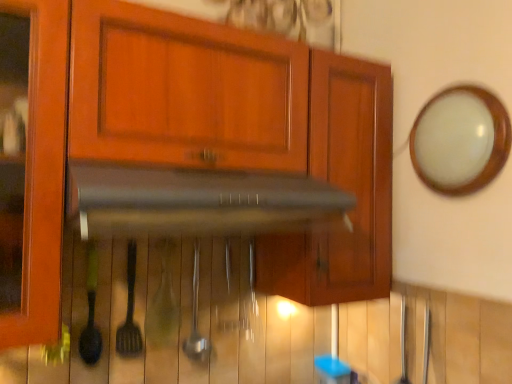
Question: From a real-world perspective, is black matte vent at center physically above metallic spatula at center, positioned as the 1th silverware in left-to-right order?

Choices:
 (A) no
 (B) yes

Answer: (B)

Question: Can you confirm if black matte vent at center is bigger than metallic spatula at center, which is counted as the 2th silverware, starting from the right?

Choices:
 (A) no
 (B) yes

Answer: (B)

Question: Does black matte vent at center lie in front of metallic spatula at center, positioned as the 1th silverware in left-to-right order?

Choices:
 (A) no
 (B) yes

Answer: (B)

Question: Is black matte vent at center aimed at metallic spatula at center, positioned as the 1th silverware in left-to-right order?

Choices:
 (A) yes
 (B) no

Answer: (B)

Question: Is black matte vent at center thinner than metallic spatula at center, positioned as the 1th silverware in left-to-right order?

Choices:
 (A) yes
 (B) no

Answer: (B)

Question: Considering the positions of satin silver spoon at center, the 1th silverware from the right, and metallic spatula at center, positioned as the 1th silverware in left-to-right order, in the image, is satin silver spoon at center, the 1th silverware from the right, wider or thinner than metallic spatula at center, positioned as the 1th silverware in left-to-right order,?

Choices:
 (A) thin
 (B) wide

Answer: (B)

Question: Based on their sizes in the image, would you say satin silver spoon at center, placed as the second silverware when sorted from left to right, is bigger or smaller than metallic spatula at center, which is counted as the 2th silverware, starting from the right?

Choices:
 (A) small
 (B) big

Answer: (B)

Question: Is point (201, 359) closer or farther from the camera than point (128, 291)?

Choices:
 (A) farther
 (B) closer

Answer: (A)

Question: Is satin silver spoon at center, the 1th silverware from the right, spatially inside metallic spatula at center, which is counted as the 2th silverware, starting from the right, or outside of it?

Choices:
 (A) inside
 (B) outside

Answer: (B)

Question: In terms of height, does white glossy mirror at upper right look taller or shorter compared to metallic spatula at center, positioned as the 1th silverware in left-to-right order?

Choices:
 (A) short
 (B) tall

Answer: (A)

Question: From the image's perspective, is white glossy mirror at upper right located above or below metallic spatula at center, positioned as the 1th silverware in left-to-right order?

Choices:
 (A) above
 (B) below

Answer: (A)

Question: Is white glossy mirror at upper right inside the boundaries of metallic spatula at center, positioned as the 1th silverware in left-to-right order, or outside?

Choices:
 (A) inside
 (B) outside

Answer: (B)

Question: Considering the positions of white glossy mirror at upper right and metallic spatula at center, positioned as the 1th silverware in left-to-right order, in the image, is white glossy mirror at upper right wider or thinner than metallic spatula at center, positioned as the 1th silverware in left-to-right order,?

Choices:
 (A) thin
 (B) wide

Answer: (B)

Question: In terms of width, does metallic spatula at center, positioned as the 1th silverware in left-to-right order, look wider or thinner when compared to white glossy mirror at upper right?

Choices:
 (A) thin
 (B) wide

Answer: (A)

Question: Is metallic spatula at center, positioned as the 1th silverware in left-to-right order, situated inside white glossy mirror at upper right or outside?

Choices:
 (A) inside
 (B) outside

Answer: (B)